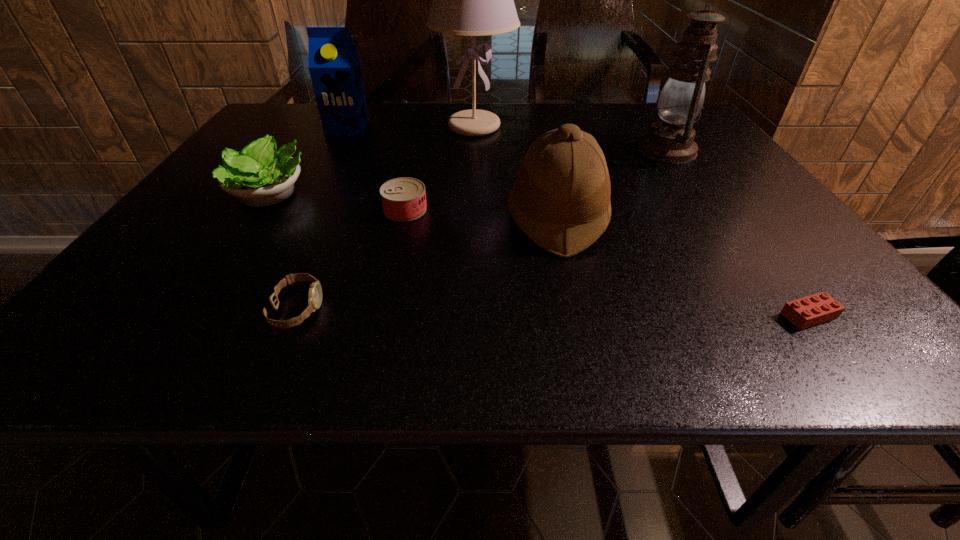
Where is `free location that satisfies the following two spatial constraints: 1. with the cap open on the carton; 2. on the right side of the Lego`? The width and height of the screenshot is (960, 540). free location that satisfies the following two spatial constraints: 1. with the cap open on the carton; 2. on the right side of the Lego is located at coordinates (248, 315).

Locate an element on the screen. free space that satisfies the following two spatial constraints: 1. on the front side of the can; 2. on the face of the watch is located at coordinates (383, 309).

Identify the location of free point that satisfies the following two spatial constraints: 1. with the cap open on the carton; 2. on the right side of the shortest object. (248, 315).

This screenshot has height=540, width=960. Identify the location of free space that satisfies the following two spatial constraints: 1. with the cap open on the second tallest object; 2. on the left side of the carton. (336, 151).